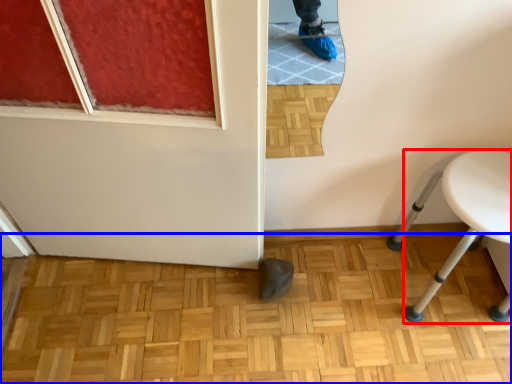
Question: Which object appears farthest to the camera in this image, furniture (highlighted by a red box) or hardwood (highlighted by a blue box)?

Choices:
 (A) furniture
 (B) hardwood

Answer: (B)